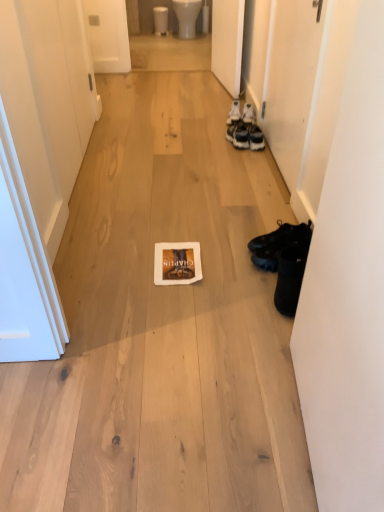
This screenshot has width=384, height=512. I want to click on free region under white matte door at upper right, marked as the 2th door in a right-to-left arrangement (from a real-world perspective), so click(x=216, y=80).